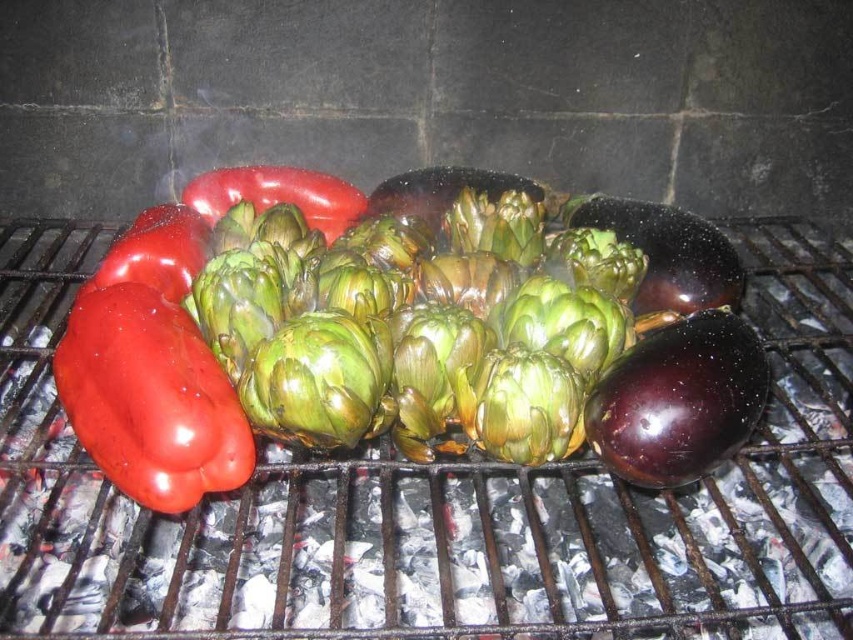
Question: Can you confirm if green matte artichoke at center is positioned below shiny dark purple eggplant at center-right?

Choices:
 (A) yes
 (B) no

Answer: (A)

Question: Which of the following is the closest to the observer?

Choices:
 (A) (288, 400)
 (B) (115, 349)

Answer: (A)

Question: Can you confirm if shiny purple eggplant at right is positioned to the left of shiny dark purple eggplant at center-right?

Choices:
 (A) no
 (B) yes

Answer: (B)

Question: Where is green matte artichoke at center located in relation to shiny dark purple eggplant at center-right in the image?

Choices:
 (A) right
 (B) left

Answer: (B)

Question: Which of the following is the closest to the observer?

Choices:
 (A) (755, 419)
 (B) (395, 307)
 (C) (54, 358)

Answer: (A)

Question: Which object is closer to the camera taking this photo?

Choices:
 (A) shiny dark purple eggplant at center-right
 (B) green matte artichoke at center
 (C) shiny red bell pepper at left
 (D) shiny purple eggplant at right

Answer: (C)